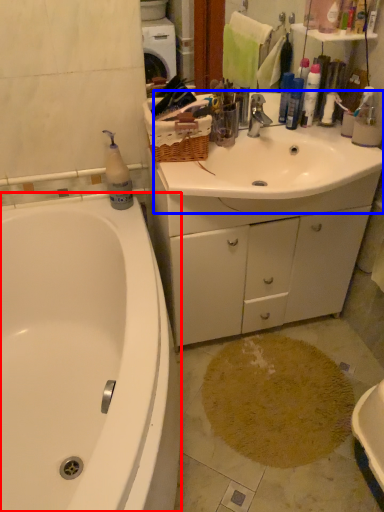
Question: Which of the following is the closest to the observer, bathtub (highlighted by a red box) or sink (highlighted by a blue box)?

Choices:
 (A) bathtub
 (B) sink

Answer: (A)